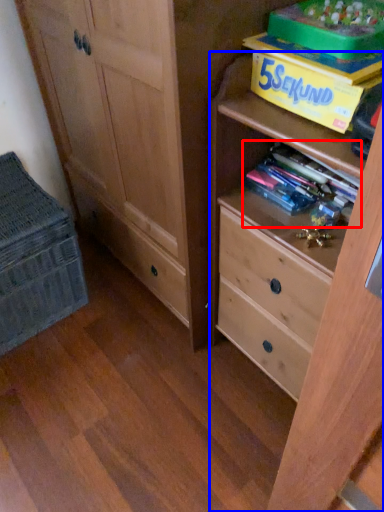
Question: Which point is further to the camera, book (highlighted by a red box) or chest of drawers (highlighted by a blue box)?

Choices:
 (A) book
 (B) chest of drawers

Answer: (A)